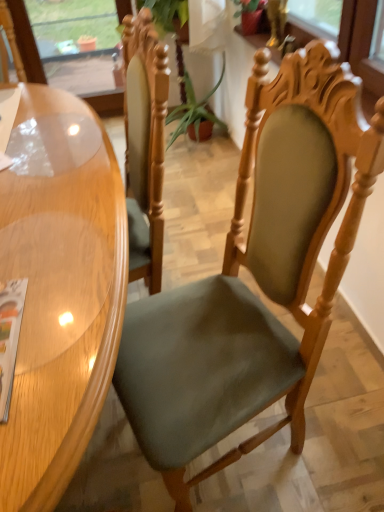
Identify the location of vacant space behind matte paper magazine at lower left. Image resolution: width=384 pixels, height=512 pixels. (45, 234).